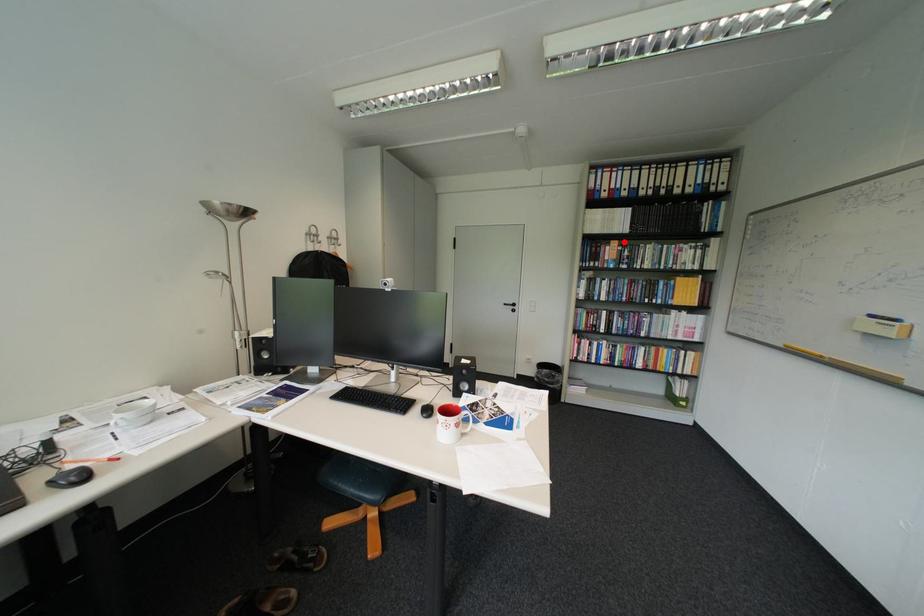
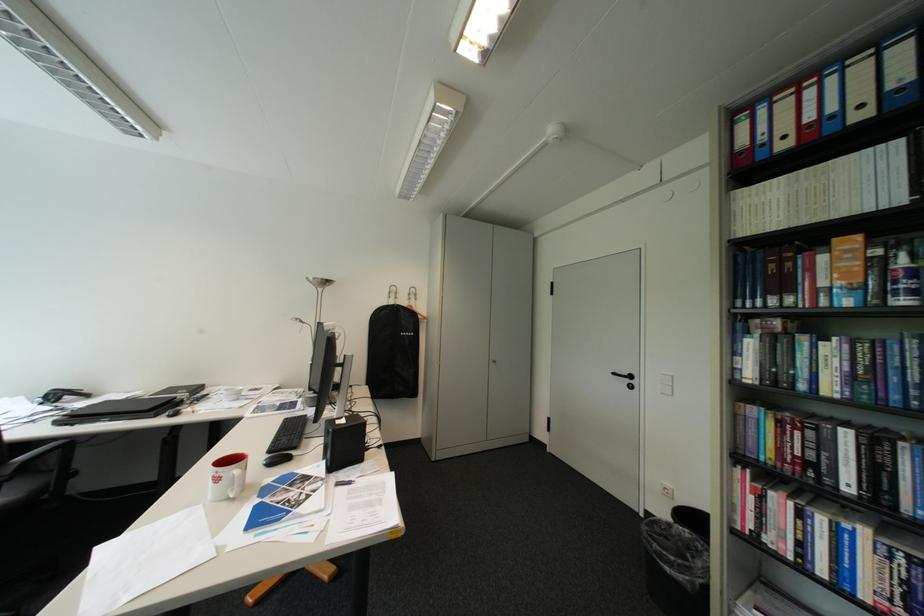
In the second image, find the point that corresponds to the highlighted location in the first image.

(848, 240)